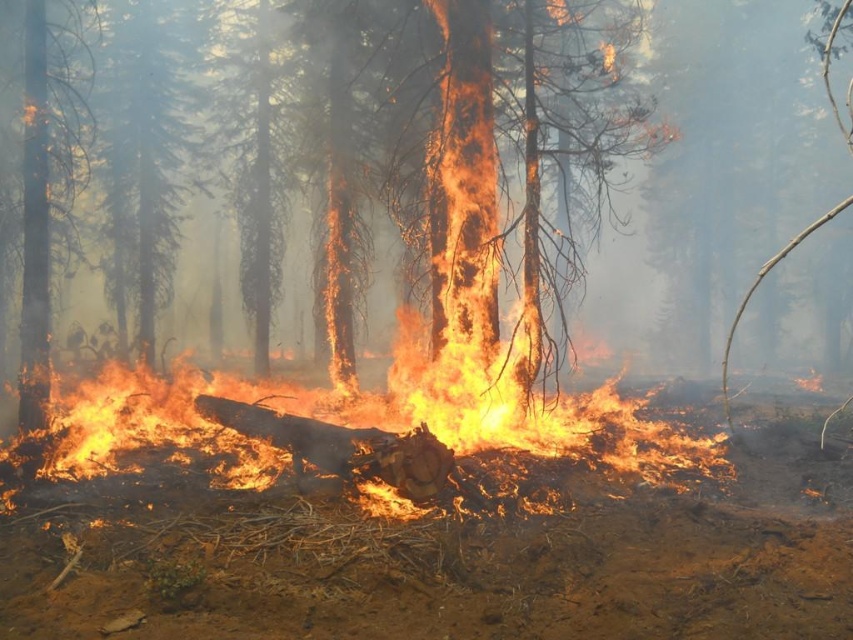
Question: Which object is farther from the camera taking this photo?

Choices:
 (A) smooth bark tree at upper left
 (B) charred wood trunk at center
 (C) flaming wood at center

Answer: (A)

Question: Which point appears closest to the camera in this image?

Choices:
 (A) (450, 410)
 (B) (762, 131)

Answer: (A)

Question: Is charred wood trunk at center smaller than smooth bark tree at upper left?

Choices:
 (A) no
 (B) yes

Answer: (A)

Question: Can you confirm if flaming wood at center is positioned to the right of charred wood trunk at center?

Choices:
 (A) no
 (B) yes

Answer: (A)

Question: Does charred wood trunk at center have a greater width compared to smooth bark tree at upper left?

Choices:
 (A) no
 (B) yes

Answer: (B)

Question: Which point is closer to the camera?

Choices:
 (A) flaming wood at center
 (B) charred wood trunk at center
 (C) smooth bark tree at upper left

Answer: (B)